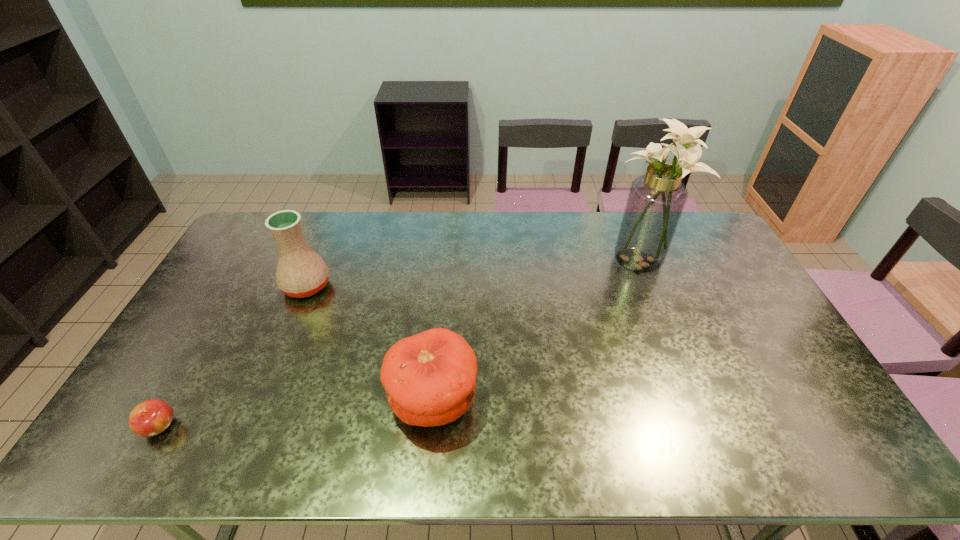
The height and width of the screenshot is (540, 960). I want to click on flower arrangement, so click(x=656, y=200).

This screenshot has height=540, width=960. I want to click on the tallest object, so click(x=656, y=200).

Find the location of a particular element. pottery is located at coordinates coord(301,272).

The height and width of the screenshot is (540, 960). What are the coordinates of `the second tallest object` in the screenshot? It's located at (301, 272).

This screenshot has height=540, width=960. Identify the location of pumpkin. (429, 378).

Identify the location of the third object from left to right. The image size is (960, 540). (429, 378).

Identify the location of apple. Image resolution: width=960 pixels, height=540 pixels. tap(152, 417).

Identify the location of the shortest object. The width and height of the screenshot is (960, 540). (152, 417).

At what (x,y) coordinates should I click in order to perform the action: click on free location located on the right of the flower arrangement. Please return your answer as a coordinate pair (x, y). The height and width of the screenshot is (540, 960). Looking at the image, I should click on click(x=720, y=259).

At what (x,y) coordinates should I click in order to perform the action: click on vacant space situated on the front of the second object from left to right. Please return your answer as a coordinate pair (x, y). Looking at the image, I should click on (274, 366).